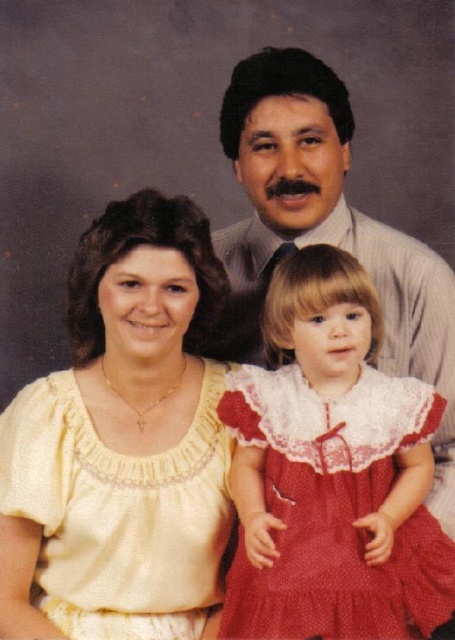
Can you confirm if yellow satin blouse at center is shorter than red lace dress at center?

No, yellow satin blouse at center is not shorter than red lace dress at center.

Locate an element on the screen. yellow satin blouse at center is located at coordinates (121, 429).

The image size is (455, 640). I want to click on yellow satin blouse at center, so click(x=121, y=429).